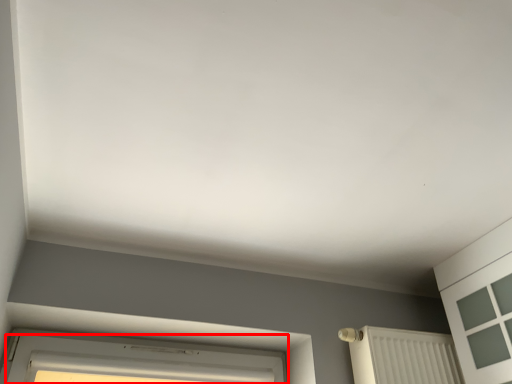
Question: From the image, what is the correct spatial relationship of window (annotated by the red box) in relation to radiator?

Choices:
 (A) left
 (B) right

Answer: (A)